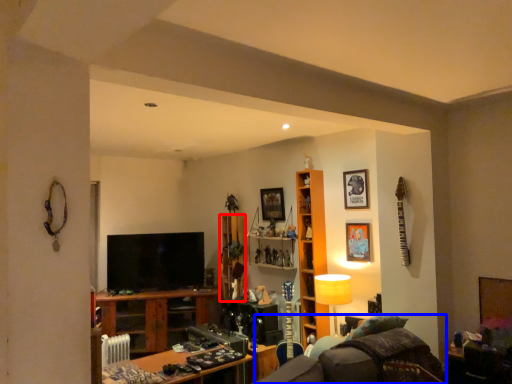
Question: Which of the following is the farthest to the observer, cabinet (highlighted by a red box) or swivel chair (highlighted by a blue box)?

Choices:
 (A) cabinet
 (B) swivel chair

Answer: (A)